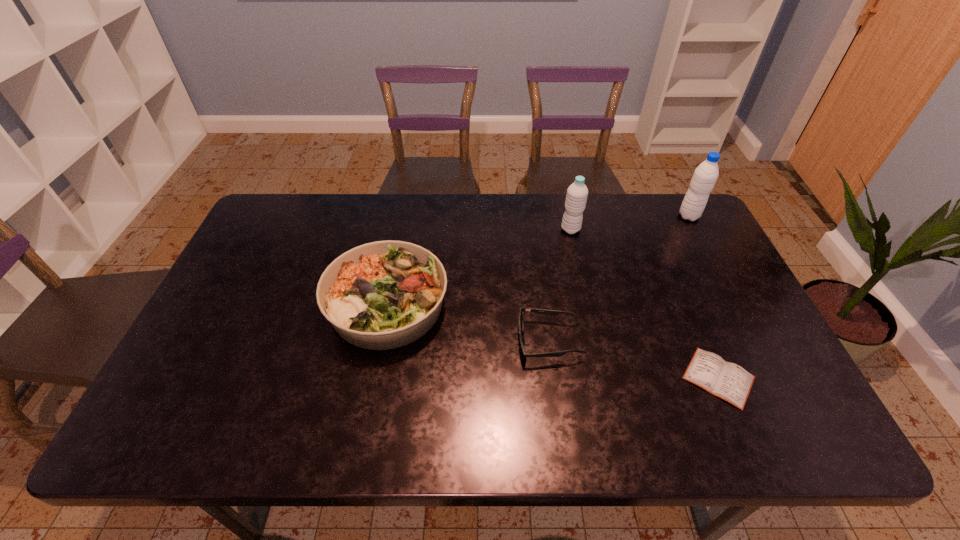
Identify the location of object positioned at the far right corner. (705, 176).

I want to click on object that is at the near right corner, so click(x=728, y=381).

Identify the location of vacant space at the far edge of the desktop. (642, 239).

Locate an element on the screen. This screenshot has height=540, width=960. free space at the near edge of the desktop is located at coordinates (470, 415).

The height and width of the screenshot is (540, 960). In the image, there is a desktop. Find the location of `vacant space at the left edge`. vacant space at the left edge is located at coordinates (221, 356).

You are a GUI agent. You are given a task and a screenshot of the screen. Output one action in this format:
    pyautogui.click(x=<x>, y=<y>)
    Task: Click on the vacant space at the right edge of the desktop
    The height and width of the screenshot is (540, 960).
    Given the screenshot: What is the action you would take?
    pyautogui.click(x=675, y=256)

In the image, there is a desktop. Where is `vacant space at the far left corner`? This screenshot has width=960, height=540. vacant space at the far left corner is located at coordinates (290, 213).

Image resolution: width=960 pixels, height=540 pixels. In order to click on free space between the third shortest object and the right water bottle in this screenshot , I will do `click(539, 261)`.

Locate an element on the screen. This screenshot has width=960, height=540. empty space between the shortest object and the right water bottle is located at coordinates (704, 297).

The height and width of the screenshot is (540, 960). I want to click on free space between the shortest object and the nearer water bottle, so click(645, 303).